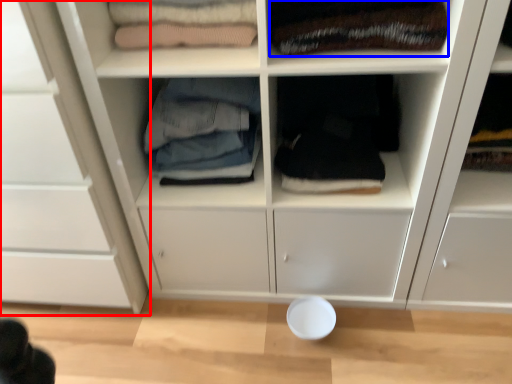
Question: Which point is further to the camera, cupboard (highlighted by a red box) or clothing (highlighted by a blue box)?

Choices:
 (A) cupboard
 (B) clothing

Answer: (B)